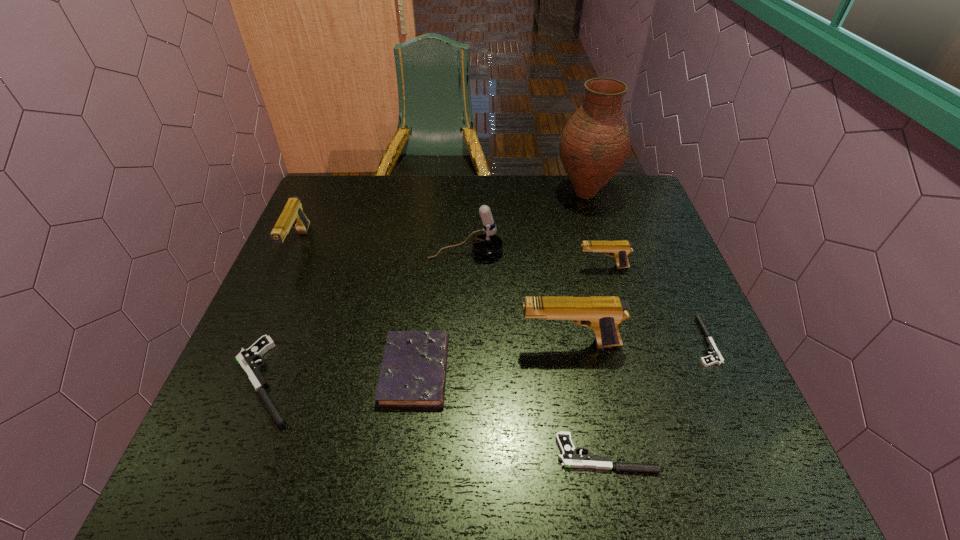
Identify the location of vacant region located 0.130m on the front-facing side of the rightmost black pistol. This screenshot has width=960, height=540. (634, 341).

Locate an element on the screen. Image resolution: width=960 pixels, height=540 pixels. free space located 0.120m on the front-facing side of the rightmost black pistol is located at coordinates (638, 341).

Identify the location of object present at the far edge. The width and height of the screenshot is (960, 540). (595, 143).

At what (x,y) coordinates should I click in order to perform the action: click on object that is at the near edge. Please return your answer as a coordinate pair (x, y). Looking at the image, I should click on (569, 458).

The image size is (960, 540). Identify the location of vase present at the right edge. (595, 143).

Find the location of a particular element. The height and width of the screenshot is (540, 960). object positioned at the far right corner is located at coordinates (595, 143).

The width and height of the screenshot is (960, 540). Find the location of `vacant space at the far edge of the desktop`. vacant space at the far edge of the desktop is located at coordinates (511, 177).

Locate an element on the screen. The image size is (960, 540). vacant region at the near edge is located at coordinates (315, 472).

In the image, there is a desktop. Where is `vacant space at the left edge`? vacant space at the left edge is located at coordinates (323, 315).

In the image, there is a desktop. Identify the location of vacant space at the right edge. (630, 282).